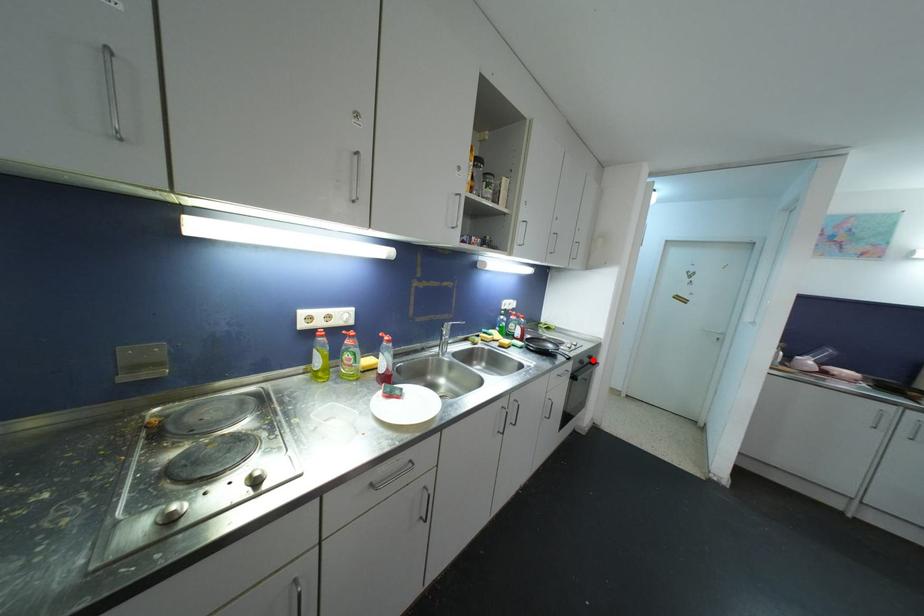
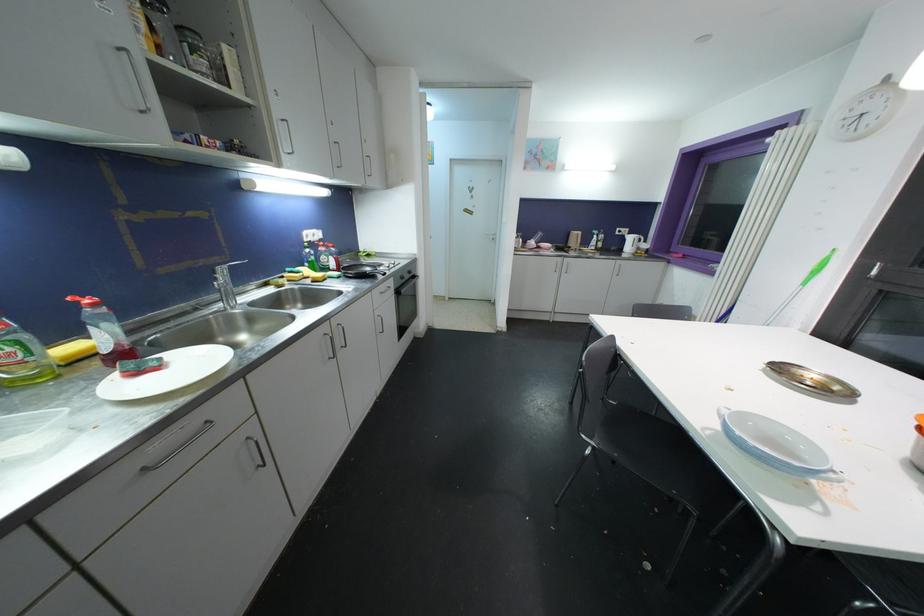
Locate, in the second image, the point that corresponds to the highlighted location in the first image.

(412, 275)